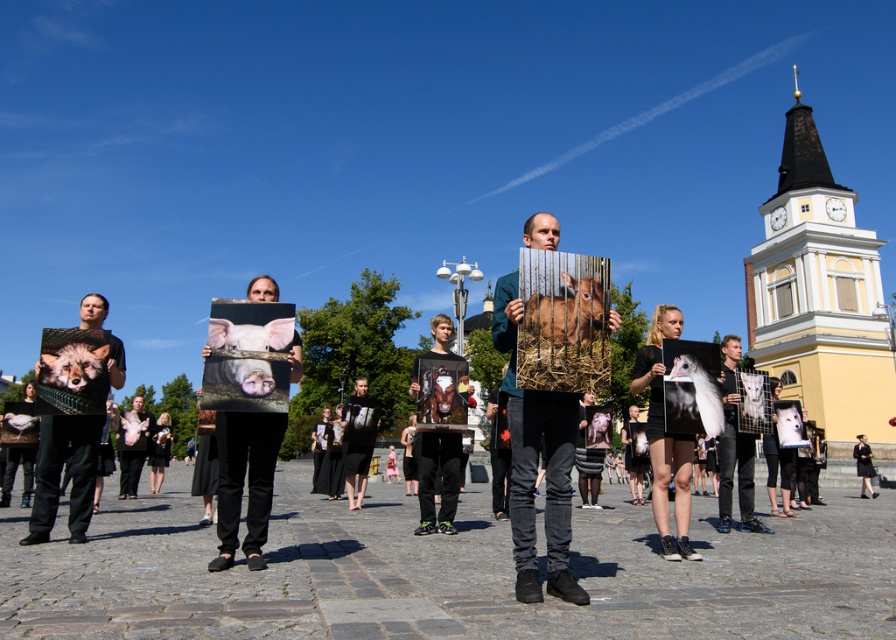
Question: Which of these objects is positioned closest to the wooden cow at center?

Choices:
 (A) smooth stone pavement at center
 (B) matte black dress at center

Answer: (B)

Question: Can you confirm if matte black dress at center is positioned above black fabric dress at center?

Choices:
 (A) yes
 (B) no

Answer: (A)

Question: Is wooden cow at center above matte black pig at center?

Choices:
 (A) no
 (B) yes

Answer: (A)

Question: Which point is farther from the camera taking this photo?

Choices:
 (A) (261, 435)
 (B) (662, 484)
 (C) (515, 400)
 (D) (862, 442)

Answer: (D)

Question: Does matte black pig at center have a smaller size compared to black fabric dress at center?

Choices:
 (A) yes
 (B) no

Answer: (A)

Question: Which point is farther from the camera taking this photo?

Choices:
 (A) (556, 404)
 (B) (304, 630)
 (C) (230, 445)
 (D) (686, 486)

Answer: (D)